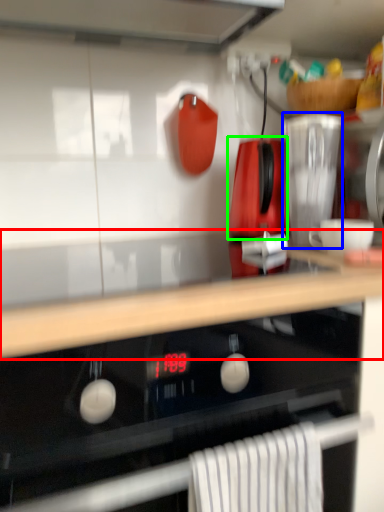
Question: Which object is positioned closest to countertop (highlighted by a red box)? Select from kitchen appliance (highlighted by a blue box) and kitchen appliance (highlighted by a green box).

Choices:
 (A) kitchen appliance
 (B) kitchen appliance

Answer: (A)